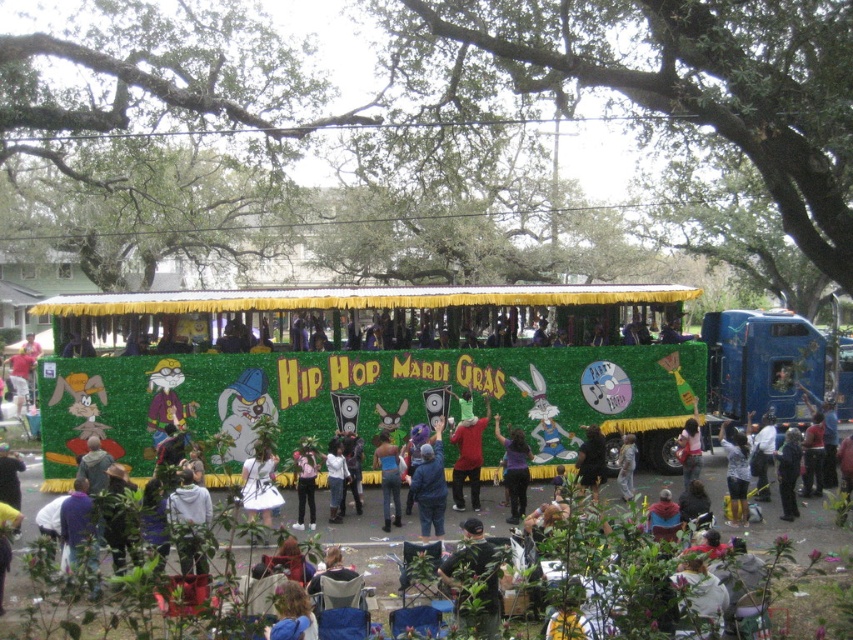
Is blue metallic food truck at right to the right of purple matte shirt at center from the viewer's perspective?

Yes, blue metallic food truck at right is to the right of purple matte shirt at center.

Looking at this image, who is higher up, blue metallic food truck at right or purple matte shirt at center?

blue metallic food truck at right

Who is more forward, (732, 387) or (519, 486)?

Point (519, 486)

Where is `blue metallic food truck at right`? This screenshot has width=853, height=640. blue metallic food truck at right is located at coordinates [763, 362].

Between multicolored fabric crowd at center and white satin dress at center, which one appears on the left side from the viewer's perspective?

From the viewer's perspective, white satin dress at center appears more on the left side.

Can you confirm if multicolored fabric crowd at center is taller than white satin dress at center?

In fact, multicolored fabric crowd at center may be shorter than white satin dress at center.

What do you see at coordinates (368, 552) in the screenshot?
I see `multicolored fabric crowd at center` at bounding box center [368, 552].

Locate an element on the screen. The width and height of the screenshot is (853, 640). multicolored fabric crowd at center is located at coordinates (368, 552).

Which is more to the right, dark gray fabric jacket at center or camouflage-patterned shirt at center?

From the viewer's perspective, dark gray fabric jacket at center appears more on the right side.

Can you confirm if dark gray fabric jacket at center is positioned below camouflage-patterned shirt at center?

Indeed, dark gray fabric jacket at center is positioned under camouflage-patterned shirt at center.

Which is behind, point (798, 458) or point (630, 497)?

The point (630, 497) is behind.

Where is `dark gray fabric jacket at center`? dark gray fabric jacket at center is located at coordinates (788, 472).